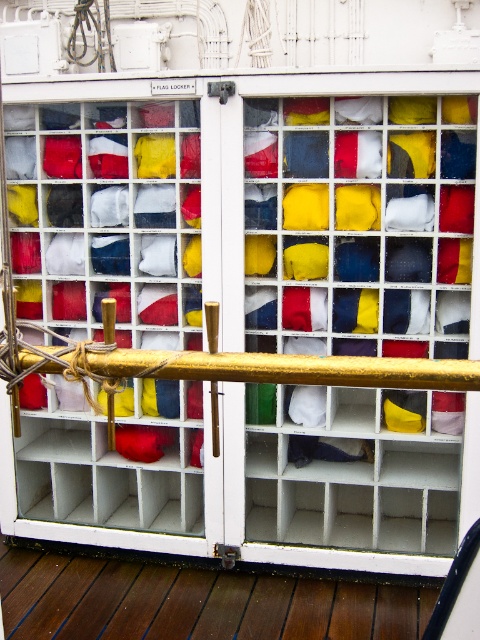
Can you confirm if brown wooden deck at lower center is positioned below gold polished metal rail at center?

Correct, brown wooden deck at lower center is located below gold polished metal rail at center.

Does point (410, 612) come in front of point (271, 372)?

No, (410, 612) is further to viewer.

Which is behind, point (245, 582) or point (431, 381)?

Point (245, 582)

The width and height of the screenshot is (480, 640). Find the location of `brown wooden deck at lower center`. brown wooden deck at lower center is located at coordinates click(x=195, y=602).